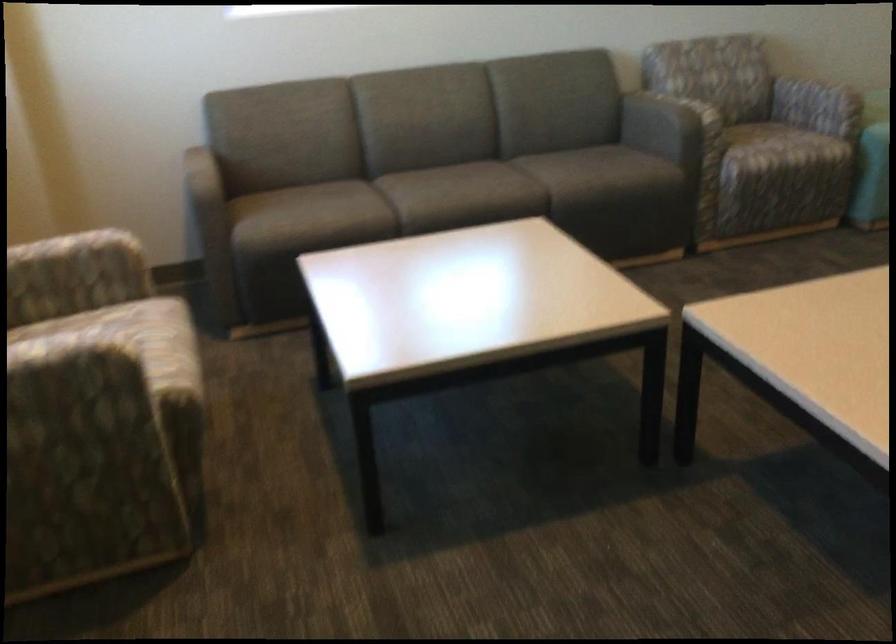
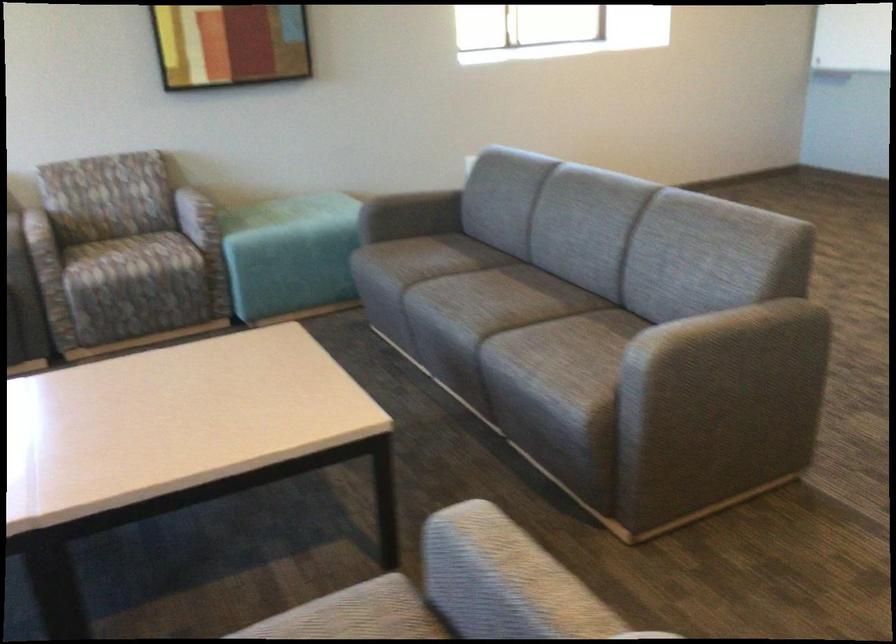
Find the pixel in the second image that matches point (754, 140) in the first image.

(125, 259)